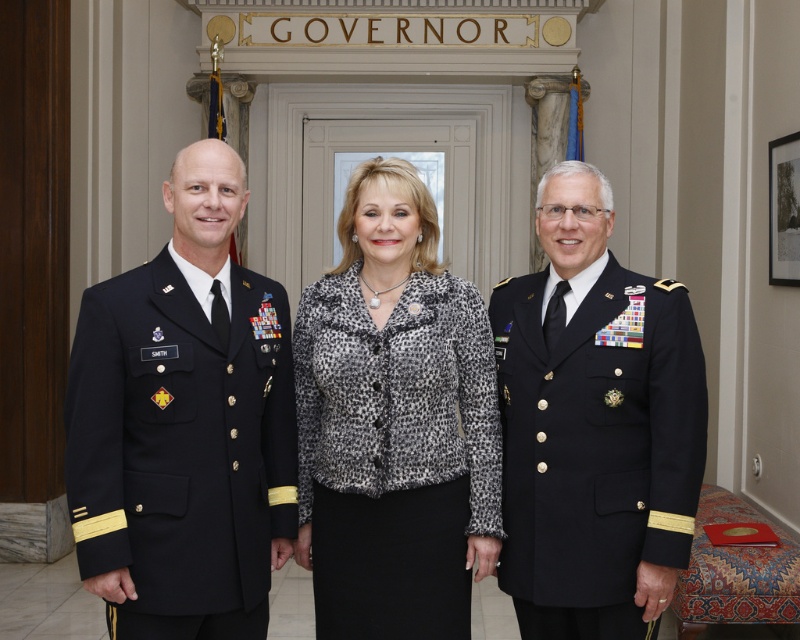
Question: Where is leopard print blouse at center located in relation to leopard print jacket at center in the image?

Choices:
 (A) above
 (B) below

Answer: (B)

Question: Considering the real-world distances, which object is farthest from the leopard print jacket at center?

Choices:
 (A) navy blue fabric military uniform at left
 (B) leopard print blouse at center
 (C) dark blue wool military uniform at right

Answer: (A)

Question: Which object is the closest to the navy blue fabric military uniform at left?

Choices:
 (A) leopard print jacket at center
 (B) leopard print blouse at center
 (C) dark blue wool military uniform at right

Answer: (B)

Question: Which point is closer to the camera?

Choices:
 (A) leopard print blouse at center
 (B) navy blue fabric military uniform at left

Answer: (A)

Question: Can you confirm if leopard print blouse at center is wider than leopard print jacket at center?

Choices:
 (A) yes
 (B) no

Answer: (A)

Question: Is the position of leopard print blouse at center less distant than that of dark blue wool military uniform at right?

Choices:
 (A) yes
 (B) no

Answer: (A)